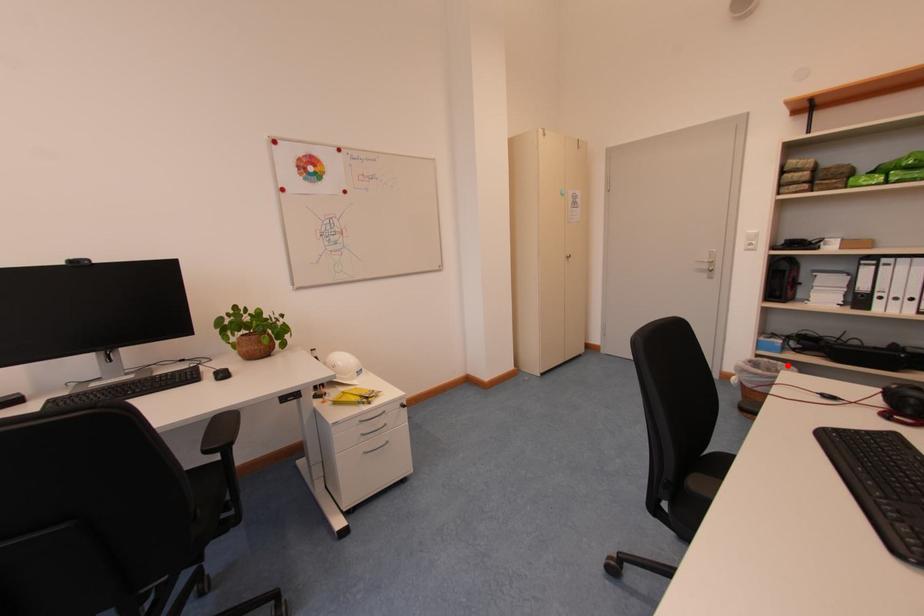
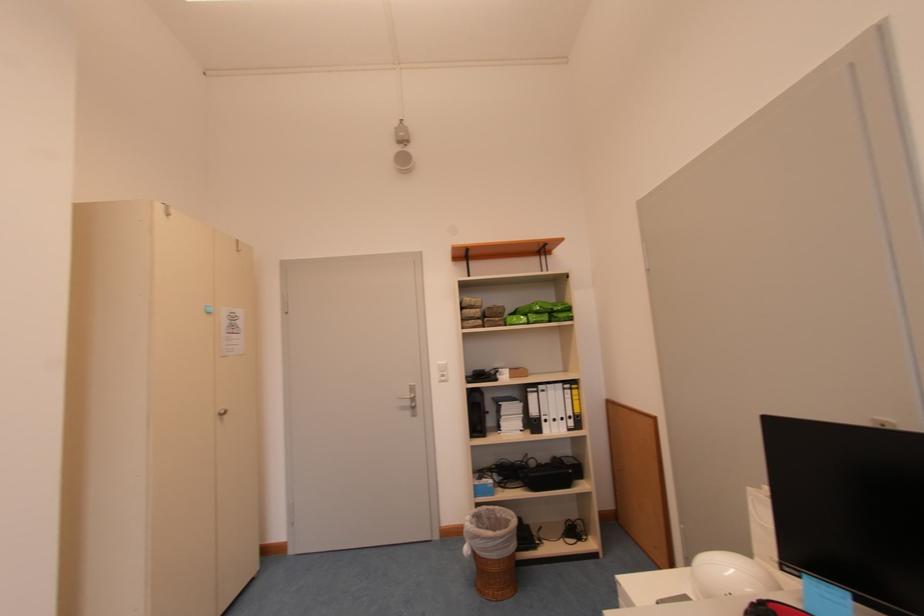
Question: A red point is marked in image1. In image2, is the corresponding 3D point closer to the camera or farther? Reply with the corresponding letter.

Choices:
 (A) The corresponding 3D point is closer.
 (B) The corresponding 3D point is farther.

Answer: (B)